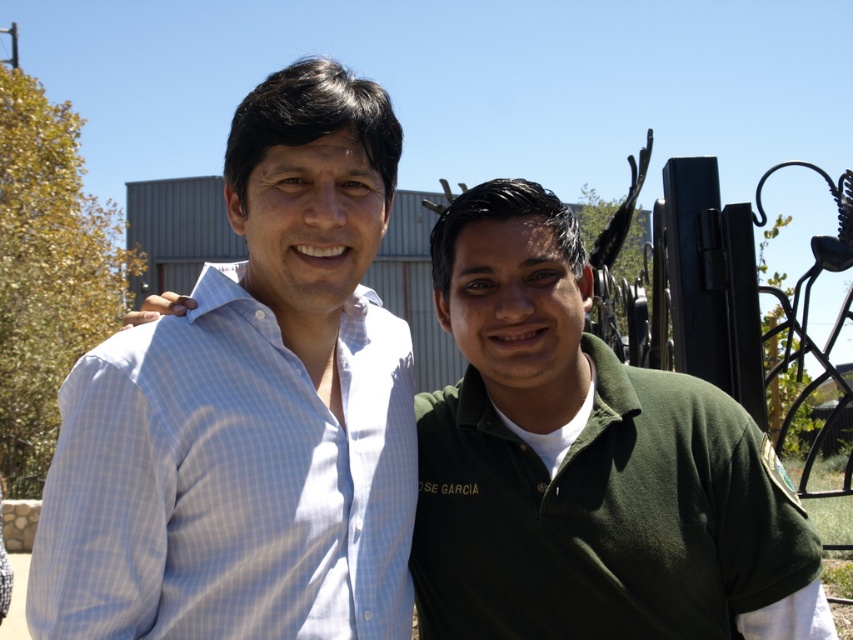
Question: Which point appears closest to the camera in this image?

Choices:
 (A) (722, 476)
 (B) (312, 452)

Answer: (B)

Question: Is light blue checkered shirt at center wider than green cotton polo shirt at center?

Choices:
 (A) yes
 (B) no

Answer: (B)

Question: Where is light blue checkered shirt at center located in relation to green cotton polo shirt at center in the image?

Choices:
 (A) above
 (B) below

Answer: (A)

Question: Can you confirm if light blue checkered shirt at center is smaller than green cotton polo shirt at center?

Choices:
 (A) yes
 (B) no

Answer: (B)

Question: Which object is farther from the camera taking this photo?

Choices:
 (A) green cotton polo shirt at center
 (B) light blue checkered shirt at center

Answer: (A)